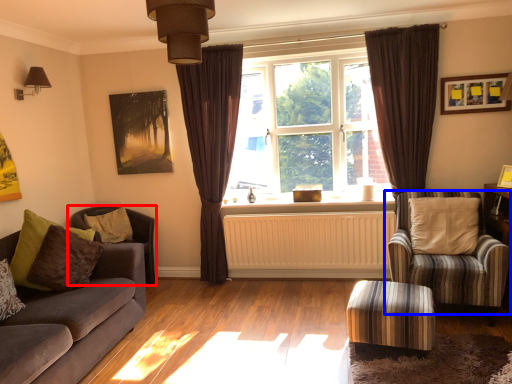
Question: Which point is closer to the camera, chair (highlighted by a red box) or chair (highlighted by a blue box)?

Choices:
 (A) chair
 (B) chair

Answer: (B)